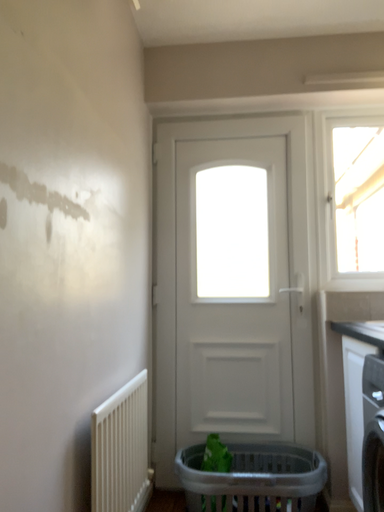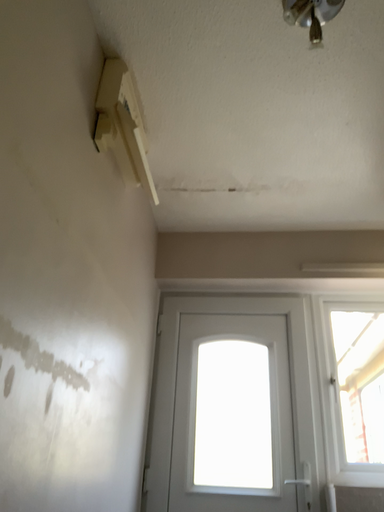
Question: Which way did the camera rotate in the video?

Choices:
 (A) rotated downward
 (B) rotated upward

Answer: (B)